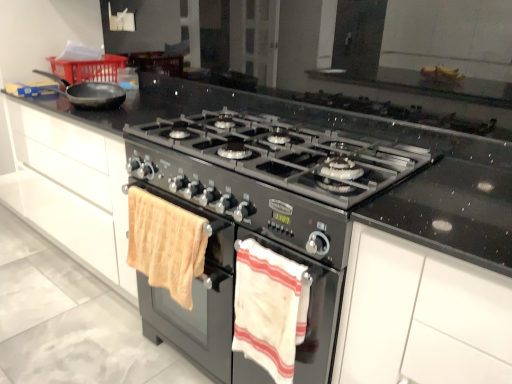
Question: Which is correct: white striped towel at lower center, the 2th beach towel when ordered from left to right, is inside beige cotton towel at lower left, positioned as the second beach towel in right-to-left order, or outside of it?

Choices:
 (A) inside
 (B) outside

Answer: (B)

Question: Is point (283, 377) positioned closer to the camera than point (180, 231)?

Choices:
 (A) closer
 (B) farther

Answer: (A)

Question: Estimate the real-world distances between objects in this image. Which object is farther from the white striped towel at lower center, the first beach towel when ordered from right to left?

Choices:
 (A) black matte frying pan at upper left
 (B) white matte cabinet at upper right
 (C) beige cotton towel at lower left, marked as the 1th beach towel in a left-to-right arrangement
 (D) black matte gas stove at center

Answer: (A)

Question: Estimate the real-world distances between objects in this image. Which object is farther from the white matte cabinet at upper right?

Choices:
 (A) black matte frying pan at upper left
 (B) black matte gas stove at center
 (C) beige cotton towel at lower left, marked as the 1th beach towel in a left-to-right arrangement
 (D) white striped towel at lower center, the first beach towel when ordered from right to left

Answer: (A)